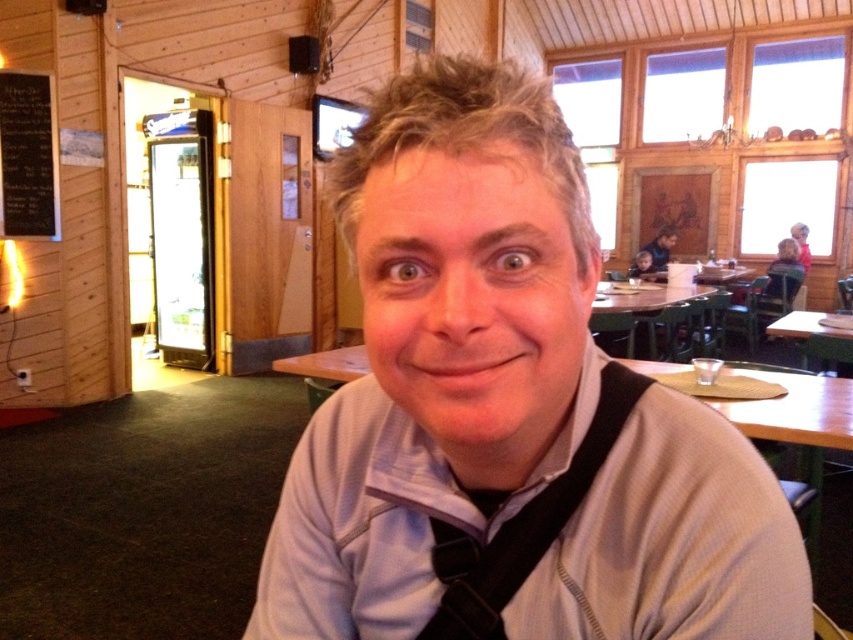
Is black chalkboard at left bigger than wooden table at center?

Incorrect, black chalkboard at left is not larger than wooden table at center.

Based on the photo, does black chalkboard at left have a smaller size compared to wooden table at center?

Yes.

Locate an element on the screen. black chalkboard at left is located at coordinates (28, 156).

Locate an element on the screen. The height and width of the screenshot is (640, 853). black chalkboard at left is located at coordinates (28, 156).

The image size is (853, 640). What do you see at coordinates (643, 296) in the screenshot?
I see `wooden table at center` at bounding box center [643, 296].

Who is positioned more to the right, wooden table at center or green matte table at right?

From the viewer's perspective, green matte table at right appears more on the right side.

Image resolution: width=853 pixels, height=640 pixels. Find the location of `wooden table at center`. wooden table at center is located at coordinates (643, 296).

Is black fabric suspenders at center above green matte table at right?

Actually, black fabric suspenders at center is below green matte table at right.

Can you confirm if black fabric suspenders at center is positioned to the left of green matte table at right?

Yes, black fabric suspenders at center is to the left of green matte table at right.

Where is `black fabric suspenders at center`? Image resolution: width=853 pixels, height=640 pixels. black fabric suspenders at center is located at coordinates (523, 525).